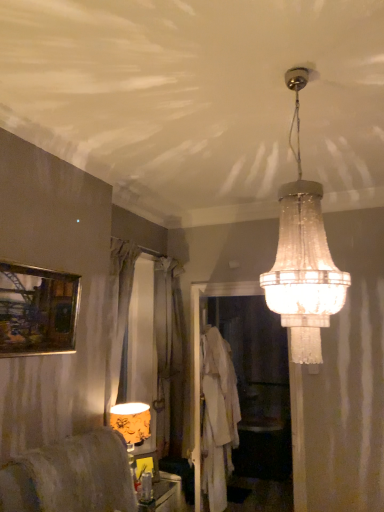
Question: Can you confirm if white fabric robe at center is taller than yellow floral fabric lampshade at lower left, the 2th lamp viewed from the right?

Choices:
 (A) yes
 (B) no

Answer: (A)

Question: Would you consider white fabric robe at center to be distant from yellow floral fabric lampshade at lower left, the 2th lamp viewed from the right?

Choices:
 (A) no
 (B) yes

Answer: (A)

Question: From a real-world perspective, is white fabric robe at center under yellow floral fabric lampshade at lower left, the 1th lamp when ordered from bottom to top?

Choices:
 (A) no
 (B) yes

Answer: (A)

Question: Considering the relative sizes of white fabric robe at center and yellow floral fabric lampshade at lower left, which appears as the second lamp when viewed from the top, in the image provided, is white fabric robe at center thinner than yellow floral fabric lampshade at lower left, which appears as the second lamp when viewed from the top,?

Choices:
 (A) yes
 (B) no

Answer: (B)

Question: Considering the relative sizes of white fabric robe at center and yellow floral fabric lampshade at lower left, the 2th lamp viewed from the right, in the image provided, is white fabric robe at center bigger than yellow floral fabric lampshade at lower left, the 2th lamp viewed from the right,?

Choices:
 (A) yes
 (B) no

Answer: (A)

Question: From a real-world perspective, does white fabric robe at center stand above yellow floral fabric lampshade at lower left, which appears as the second lamp when viewed from the top?

Choices:
 (A) no
 (B) yes

Answer: (B)

Question: Is gold-framed painting at upper left positioned in front of silky gray curtain at center?

Choices:
 (A) no
 (B) yes

Answer: (B)

Question: Is gold-framed painting at upper left not inside silky gray curtain at center?

Choices:
 (A) yes
 (B) no

Answer: (A)

Question: Does gold-framed painting at upper left have a lesser height compared to silky gray curtain at center?

Choices:
 (A) no
 (B) yes

Answer: (B)

Question: Considering the relative sizes of gold-framed painting at upper left and silky gray curtain at center in the image provided, is gold-framed painting at upper left smaller than silky gray curtain at center?

Choices:
 (A) yes
 (B) no

Answer: (A)

Question: Considering the relative sizes of gold-framed painting at upper left and silky gray curtain at center in the image provided, is gold-framed painting at upper left thinner than silky gray curtain at center?

Choices:
 (A) no
 (B) yes

Answer: (B)

Question: Is gold-framed painting at upper left to the left of silky gray curtain at center from the viewer's perspective?

Choices:
 (A) no
 (B) yes

Answer: (B)

Question: Does clear glass chandelier at upper center, the 1th lamp in the right-to-left sequence, have a larger size compared to translucent glass bottle at lower center, the 1th furniture positioned from the bottom?

Choices:
 (A) yes
 (B) no

Answer: (A)